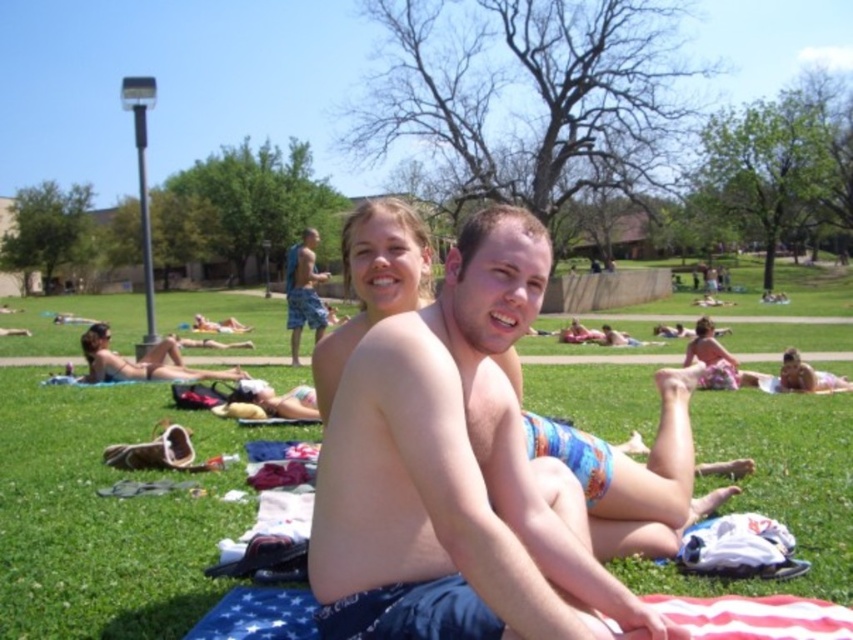
Looking at this image, you are standing at the origin point of the coordinate system in the image. You want to walk to the green grass at center. What direction should you walk to reach it?

The green grass at center is located at coordinate point 0.802 on the x axis and 0.128 on the y axis. Since you are at the origin point, you should walk towards the positive x and positive y directions to reach the green grass at center.